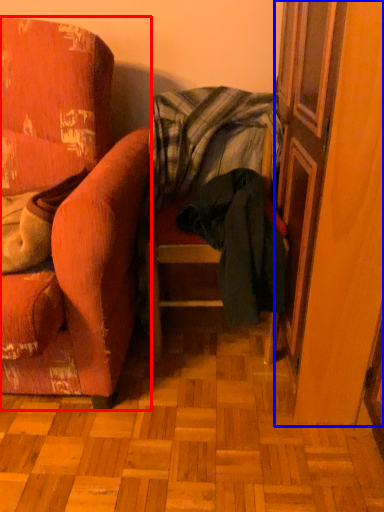
Question: Which point is further to the camera, chair (highlighted by a red box) or screen door (highlighted by a blue box)?

Choices:
 (A) chair
 (B) screen door

Answer: (B)